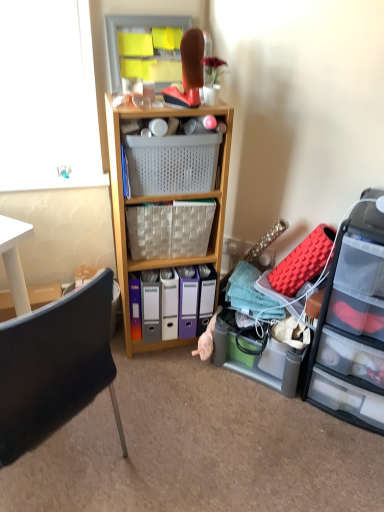
Question: In the image, is woven fabric picnic basket at center, which ranks as the 2th picnic basket in top-to-bottom order, positioned in front of or behind clear plastic drawers at right?

Choices:
 (A) behind
 (B) front

Answer: (A)

Question: From the image's perspective, is woven fabric picnic basket at center, the first picnic basket positioned from the bottom, above or below clear plastic drawers at right?

Choices:
 (A) above
 (B) below

Answer: (A)

Question: Estimate the real-world distances between objects in this image. Which object is farther from the woven fabric picnic basket at center, the first picnic basket positioned from the bottom?

Choices:
 (A) clear plastic drawers at right
 (B) plastic mesh basket at center, which is counted as the 2th picnic basket, starting from the bottom
 (C) black plastic chair at lower left
 (D) wooden shelf at center

Answer: (C)

Question: Which is farther from the clear plastic drawers at right?

Choices:
 (A) woven fabric picnic basket at center, which ranks as the 2th picnic basket in top-to-bottom order
 (B) plastic mesh basket at center, which is counted as the 2th picnic basket, starting from the bottom
 (C) black plastic chair at lower left
 (D) wooden shelf at center

Answer: (C)